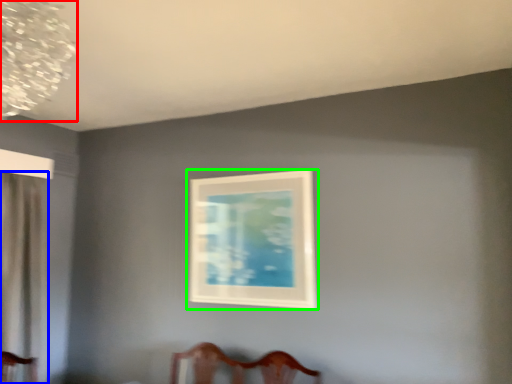
Question: Which object is positioned closest to lamp (highlighted by a red box)? Select from curtain (highlighted by a blue box) and picture frame (highlighted by a green box).

Choices:
 (A) curtain
 (B) picture frame

Answer: (A)